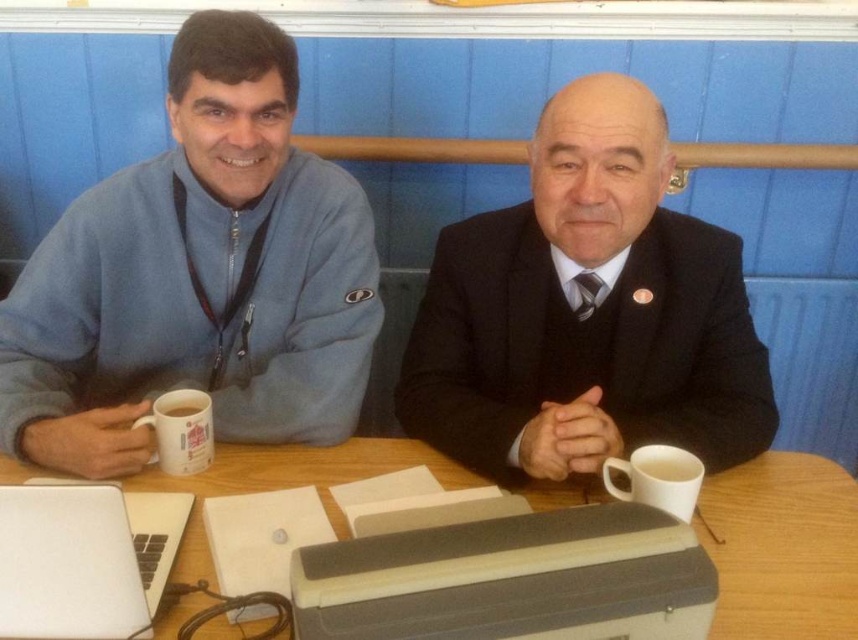
You are sitting at the table in the image and want to reach both the point at coordinates (568, 310) and the point at (677, 477). Which point will you reach first?

You will reach the point at coordinates (568, 310) first because it is closer to you than the point at (677, 477), which is further away.

Please provide the coordinates of the black suit at center in the image. The coordinates should be in the format of a point with two decimal places, such as point (587,310).

The coordinates of the black suit at center are point (587,310).